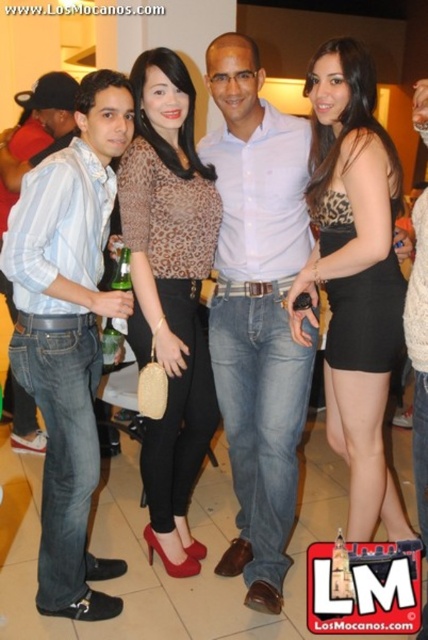
Question: Is leopard print top at center below denim jeans at left?

Choices:
 (A) no
 (B) yes

Answer: (B)

Question: Which of the following is the closest to the observer?

Choices:
 (A) (146, 540)
 (B) (356, 288)
 (C) (427, 497)
 (D) (38, 132)

Answer: (C)

Question: Which point is closer to the camera?

Choices:
 (A) (222, 323)
 (B) (418, 348)
 (C) (198, 188)
 (D) (51, 131)

Answer: (B)

Question: Is leopard print blouse at center bigger than jeans at center?

Choices:
 (A) no
 (B) yes

Answer: (A)

Question: Which point appears farthest from the camera in this image?

Choices:
 (A) (359, 280)
 (B) (198, 417)

Answer: (B)

Question: Is denim jeans at left smaller than jeans at center?

Choices:
 (A) yes
 (B) no

Answer: (B)